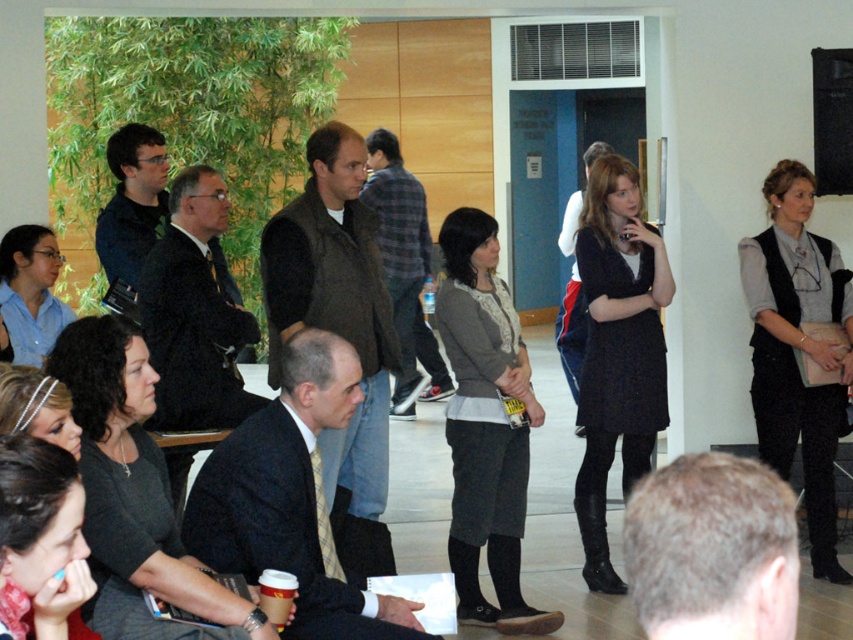
Question: Can you confirm if dark woolen dress at center is thinner than matte blue shirt at lower left?

Choices:
 (A) no
 (B) yes

Answer: (A)

Question: Which object is the farthest from the matte blue shirt at lower left?

Choices:
 (A) gray wool vest at upper right
 (B) matte black jacket at upper left

Answer: (A)

Question: Which object is closer to the camera taking this photo?

Choices:
 (A) matte black suit at center
 (B) dark woolen dress at center

Answer: (A)

Question: Which point appears closest to the camera in this image?

Choices:
 (A) (370, 360)
 (B) (801, 209)

Answer: (A)

Question: Can you confirm if dark brown vest at center is positioned to the right of dark woolen dress at center?

Choices:
 (A) yes
 (B) no

Answer: (B)

Question: From the image, what is the correct spatial relationship of gray wool vest at upper right in relation to matte blue shirt at lower left?

Choices:
 (A) below
 (B) above

Answer: (A)